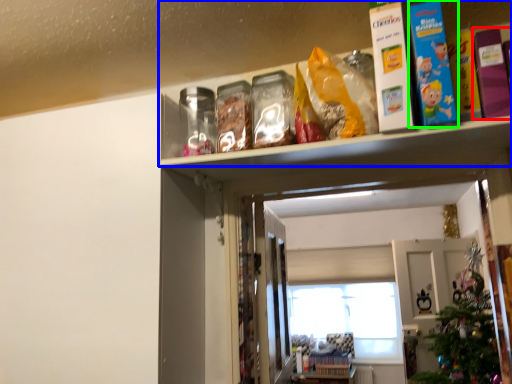
Question: Which is nearer to the book (highlighted by a red box)? shelf (highlighted by a blue box) or book (highlighted by a green box).

Choices:
 (A) shelf
 (B) book

Answer: (B)